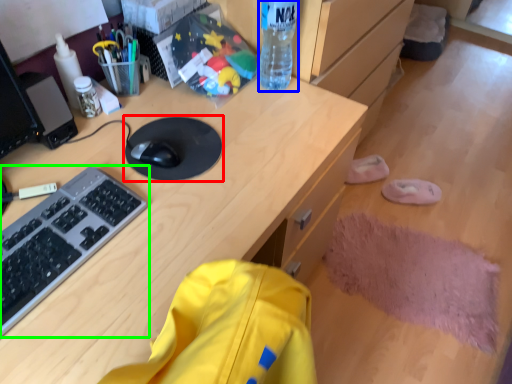
Question: Which object is the closest to the mousepad (highlighted by a red box)? Choose among these: bottle (highlighted by a blue box) or computer keyboard (highlighted by a green box).

Choices:
 (A) bottle
 (B) computer keyboard

Answer: (B)